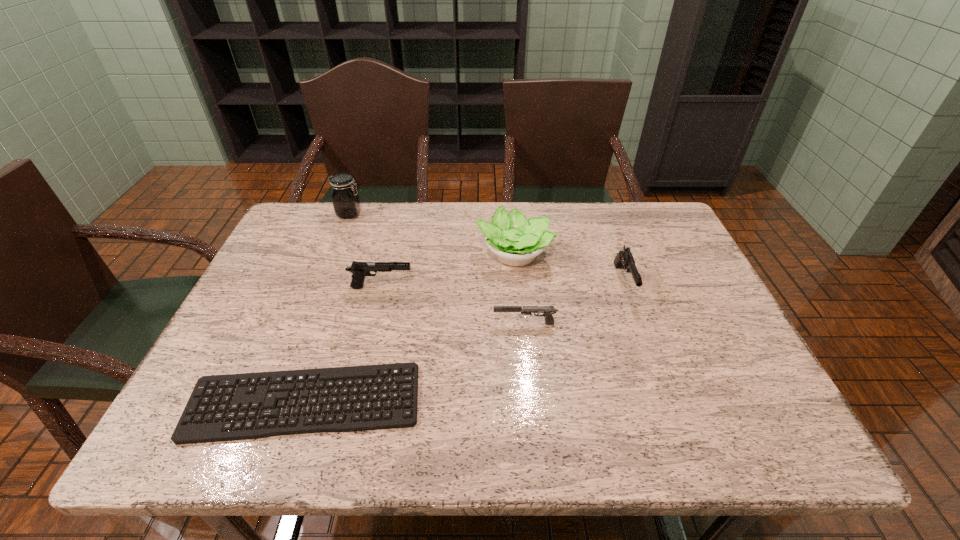
Locate an element on the screen. the tallest object is located at coordinates (346, 202).

Where is `jar`? This screenshot has height=540, width=960. jar is located at coordinates (346, 202).

This screenshot has width=960, height=540. Identify the location of lettuce. (516, 241).

Identify the location of the rightmost gun. This screenshot has width=960, height=540. coord(624,259).

The image size is (960, 540). In order to click on the leftmost gun in this screenshot , I will do `click(360, 270)`.

Identify the location of the nearest gun. The height and width of the screenshot is (540, 960). (547, 311).

Locate an element on the screen. the second gun from left to right is located at coordinates (547, 311).

You are a GUI agent. You are given a task and a screenshot of the screen. Output one action in this format:
    pyautogui.click(x=<x>, y=<y>)
    Task: Click on the nearest object
    
    Given the screenshot: What is the action you would take?
    pyautogui.click(x=205, y=432)

Locate an element on the screen. The width and height of the screenshot is (960, 540). computer keyboard is located at coordinates (205, 432).

This screenshot has height=540, width=960. Find the location of `vacant space situated on the lid of the tallest object`. vacant space situated on the lid of the tallest object is located at coordinates (420, 214).